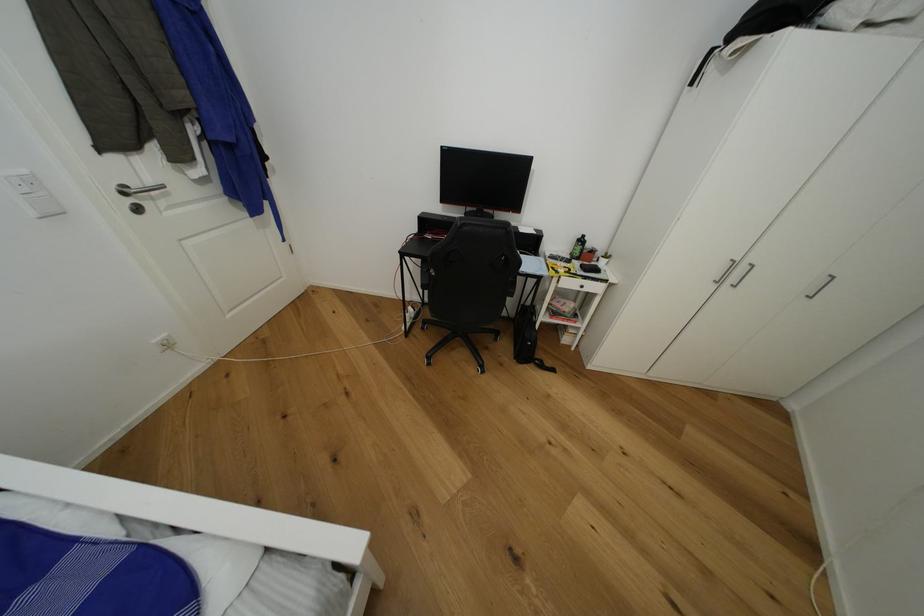
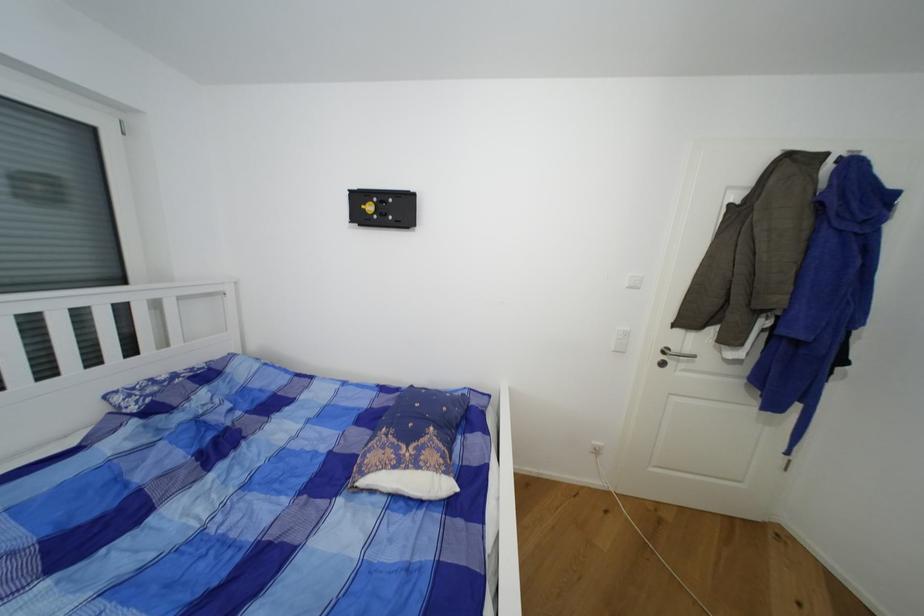
Question: The camera is either moving clockwise (left) or counter-clockwise (right) around the object. The first image is from the beginning of the video and the second image is from the end. Is the camera moving left or right when shooting the video?

Choices:
 (A) Left
 (B) Right

Answer: (B)